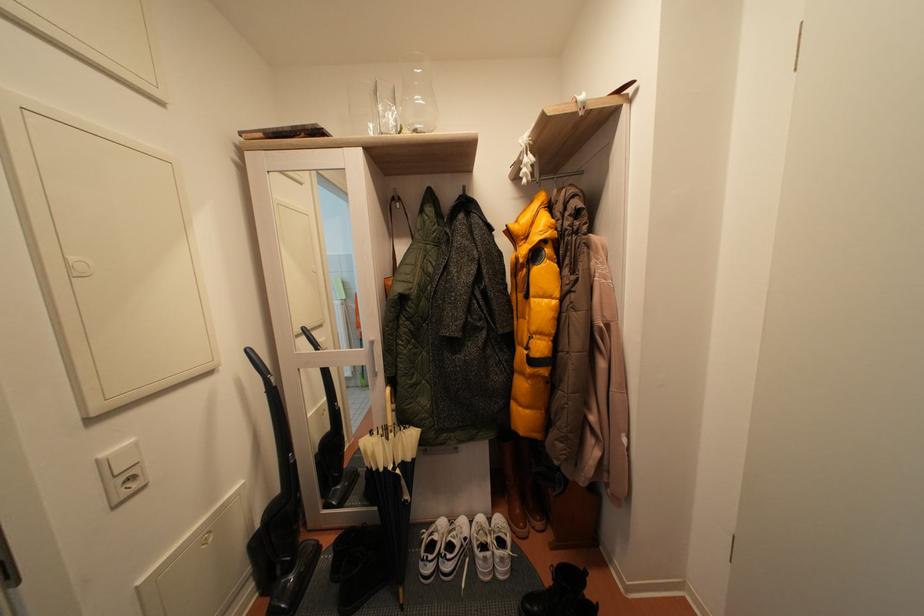
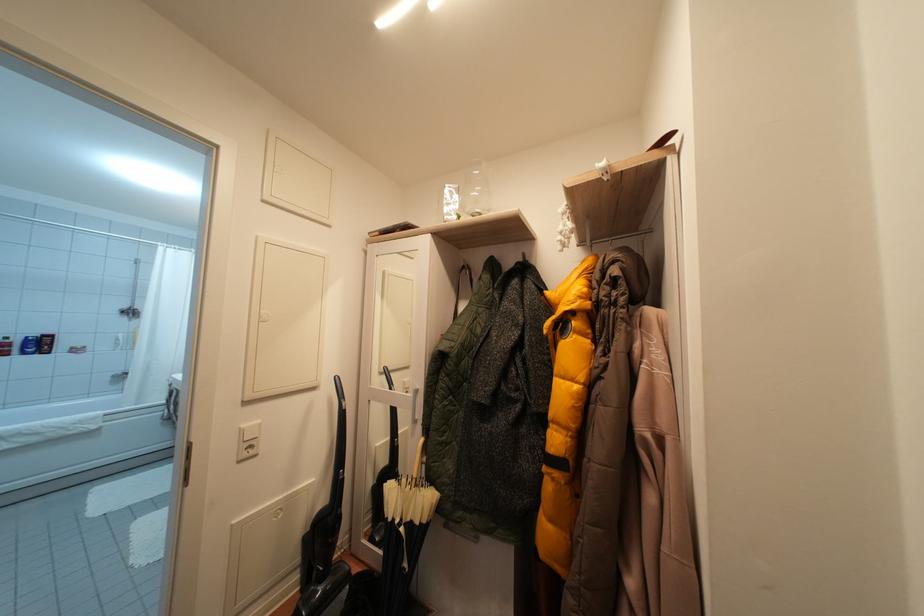
The point at (x=111, y=460) is marked in the first image. Where is the corresponding point in the second image?

(250, 431)